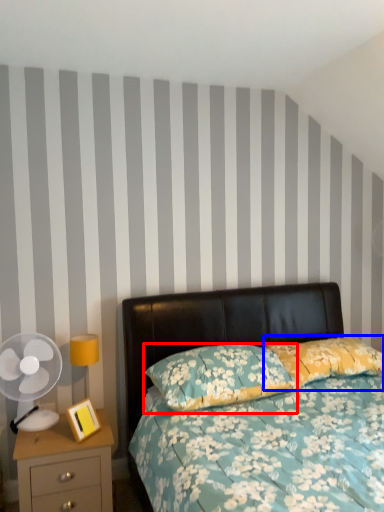
Question: Which point is further to the camera, pillow (highlighted by a red box) or pillow (highlighted by a blue box)?

Choices:
 (A) pillow
 (B) pillow

Answer: (B)